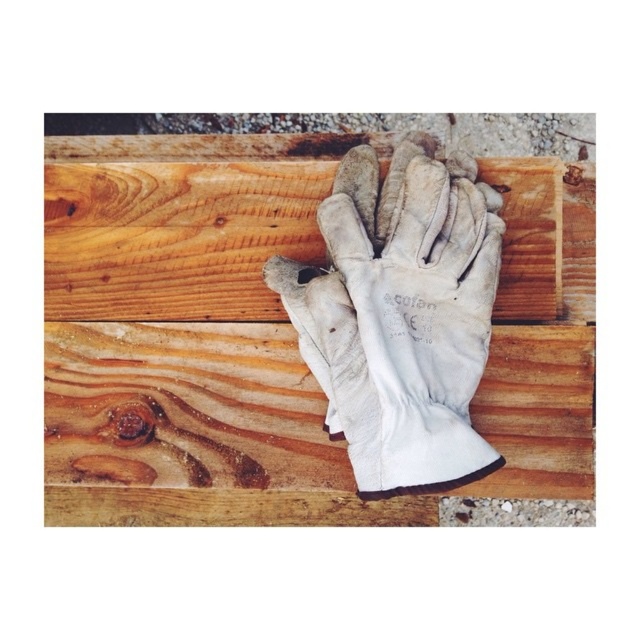
Measure the distance between point (x=454, y=384) and camera.

Point (x=454, y=384) is 3.69 feet away from camera.

Can you confirm if white leather glove at center is positioned to the right of wooden plank at center?

Indeed, white leather glove at center is positioned on the right side of wooden plank at center.

Image resolution: width=640 pixels, height=640 pixels. Identify the location of white leather glove at center. (401, 314).

The height and width of the screenshot is (640, 640). I want to click on white leather glove at center, so click(x=401, y=314).

Looking at this image, does natural wood at center have a lesser width compared to white leather glove at center?

No.

Which is in front, point (172, 355) or point (317, 285)?

Positioned in front is point (317, 285).

Does point (305, 241) come in front of point (374, 308)?

No, it is behind (374, 308).

Where is `natural wood at center`? natural wood at center is located at coordinates [189, 337].

This screenshot has width=640, height=640. What do you see at coordinates (189, 337) in the screenshot?
I see `natural wood at center` at bounding box center [189, 337].

Does natural wood at center appear on the left side of wooden plank at center?

No, natural wood at center is not to the left of wooden plank at center.

Who is more forward, (106, 412) or (138, 298)?

Point (106, 412)

Locate an element on the screen. The image size is (640, 640). natural wood at center is located at coordinates (189, 337).